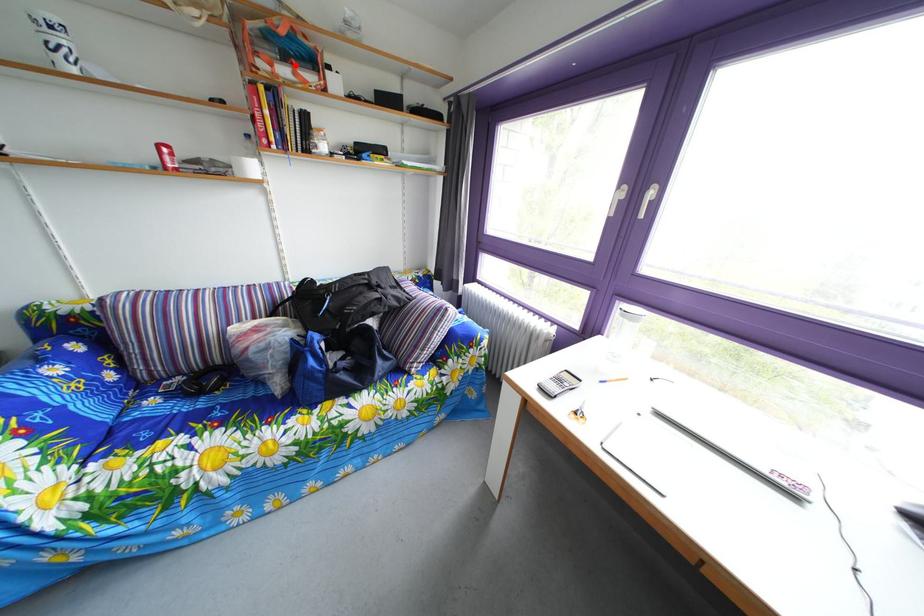
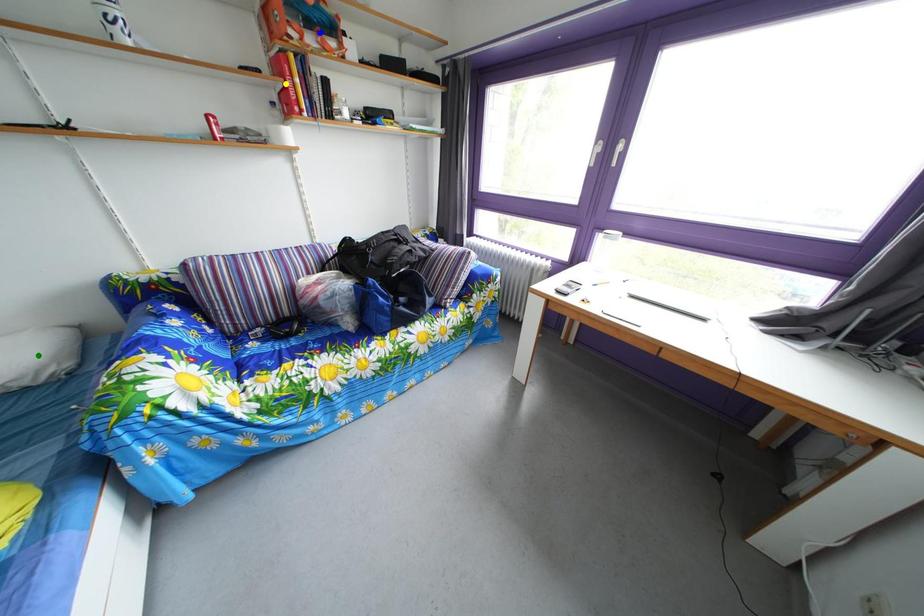
Question: I am providing you with two images of the same scene from different viewpoints. A red point is marked on the first image. You are given multiple points on the second image. Which mark in image 2 goes with the point in image 1?

Choices:
 (A) yellow point
 (B) green point
 (C) blue point

Answer: (C)